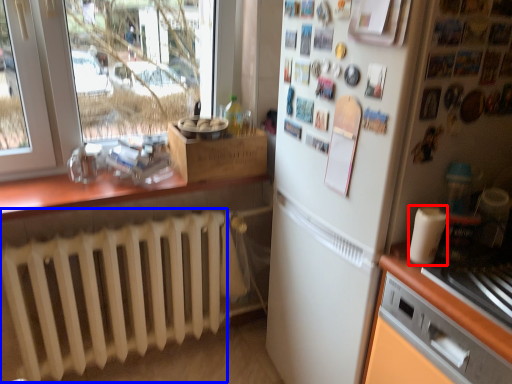
Question: Among these objects, which one is farthest to the camera, appliance (highlighted by a red box) or radiator (highlighted by a blue box)?

Choices:
 (A) appliance
 (B) radiator

Answer: (B)